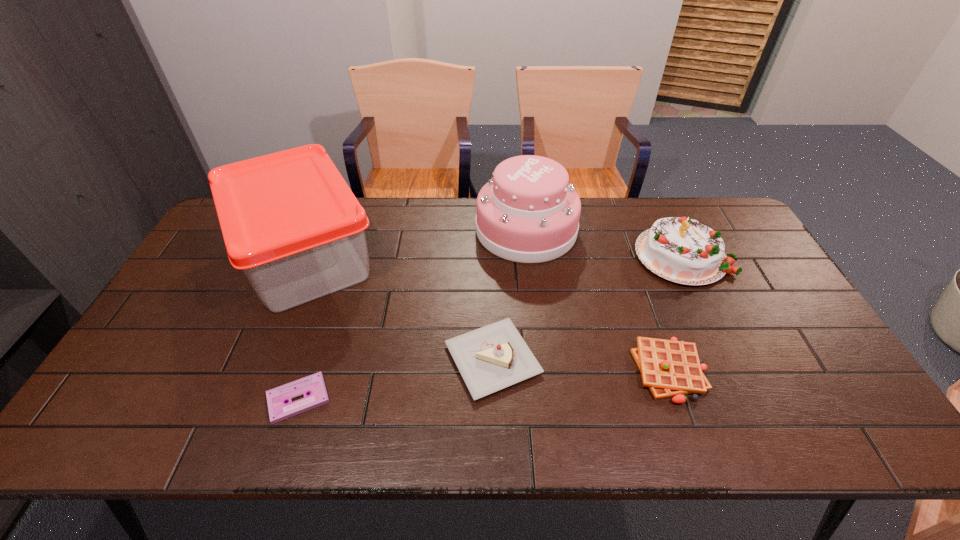
Locate an element on the screen. The width and height of the screenshot is (960, 540). free space between the waffle and the second tallest cake is located at coordinates (676, 313).

Identify the location of vacant space that is in between the videotape and the nearest cake. The height and width of the screenshot is (540, 960). (396, 379).

Identify the location of unoccupied position between the videotape and the tallest cake. The width and height of the screenshot is (960, 540). (412, 314).

The width and height of the screenshot is (960, 540). Identify the location of free space between the tray and the second shortest cake. (493, 256).

Where is `vacant area between the shortest cake and the second shortest object`? vacant area between the shortest cake and the second shortest object is located at coordinates (582, 365).

Identify the location of object that ranks as the third closest to the tray. This screenshot has width=960, height=540. (528, 212).

At what (x,y) coordinates should I click in order to perform the action: click on object that stands as the second closest to the rightmost cake. Please return your answer as a coordinate pair (x, y). Looking at the image, I should click on (669, 368).

Where is `cake that can be found as the third closest to the videotape`? The width and height of the screenshot is (960, 540). cake that can be found as the third closest to the videotape is located at coordinates (x=683, y=250).

Identify which cake is the second closest to the nearest cake. Please provide its 2D coordinates. Your answer should be formatted as a tuple, i.e. [(x, y)], where the tuple contains the x and y coordinates of a point satisfying the conditions above.

[(683, 250)]

At what (x,y) coordinates should I click in order to perform the action: click on free space that satisfies the following two spatial constraints: 1. on the back side of the nearest cake; 2. on the right side of the tallest cake. Please return your answer as a coordinate pair (x, y). The width and height of the screenshot is (960, 540). Looking at the image, I should click on (490, 230).